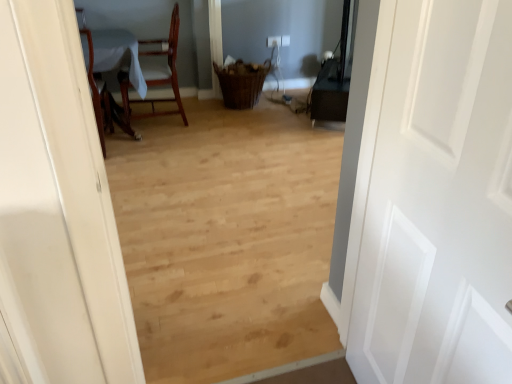
Find the location of `white matte door at right`. white matte door at right is located at coordinates (439, 202).

Identify the location of wooden table at left. The width and height of the screenshot is (512, 384). (103, 94).

The image size is (512, 384). What do you see at coordinates (156, 72) in the screenshot?
I see `mahogany wood chair at upper left` at bounding box center [156, 72].

This screenshot has width=512, height=384. I want to click on white matte door at right, so click(439, 202).

In the image, there is a white matte door at right. Find the location of `table above it (from the image's perspective)`. table above it (from the image's perspective) is located at coordinates (103, 94).

Is white matte door at right thinner than wooden table at left?

Correct, the width of white matte door at right is less than that of wooden table at left.

From the image's perspective, is white matte door at right on wooden table at left?

No, from the image's perspective, white matte door at right is not over wooden table at left.

Are wooden table at left and white matte door at right beside each other?

No.

Is wooden table at left not inside white matte door at right?

Yes, wooden table at left is outside of white matte door at right.

Between wooden table at left and white matte door at right, which one has less height?

Standing shorter between the two is wooden table at left.

Does point (132, 137) come farther from viewer compared to point (395, 297)?

Yes, point (132, 137) is farther from viewer.

Could mahogany wood chair at upper left be considered to be inside wooden table at left?

Definitely not — mahogany wood chair at upper left is not inside wooden table at left.

How many degrees apart are the facing directions of wooden table at left and mahogany wood chair at upper left?

There is a 91.4-degree angle between the facing directions of wooden table at left and mahogany wood chair at upper left.

From the image's perspective, is wooden table at left located above or below mahogany wood chair at upper left?

Clearly, from the image's perspective, wooden table at left is below mahogany wood chair at upper left.

From the image's perspective, does mahogany wood chair at upper left appear higher than wooden table at left?

Indeed, from the image's perspective, mahogany wood chair at upper left is shown above wooden table at left.

From a real-world perspective, is mahogany wood chair at upper left located beneath wooden table at left?

No, from a real-world perspective, mahogany wood chair at upper left is not beneath wooden table at left.

Does point (177, 91) lie behind point (102, 106)?

Yes.

From the image's perspective, would you say mahogany wood chair at upper left is shown under white matte door at right?

No.

From a real-world perspective, is mahogany wood chair at upper left physically below white matte door at right?

Yes, from a real-world perspective, mahogany wood chair at upper left is below white matte door at right.

Considering the positions of objects mahogany wood chair at upper left and white matte door at right in the image provided, who is behind, mahogany wood chair at upper left or white matte door at right?

mahogany wood chair at upper left.

Is mahogany wood chair at upper left placed right next to white matte door at right?

mahogany wood chair at upper left and white matte door at right are not in contact.

Can you confirm if white matte door at right is smaller than mahogany wood chair at upper left?

Yes, white matte door at right is smaller than mahogany wood chair at upper left.

From the picture: Is mahogany wood chair at upper left located within white matte door at right?

No, mahogany wood chair at upper left is located outside of white matte door at right.

Is white matte door at right far from mahogany wood chair at upper left?

Indeed, white matte door at right is not near mahogany wood chair at upper left.

In the scene shown: Which is more to the right, white matte door at right or mahogany wood chair at upper left?

Positioned to the right is white matte door at right.

Where is `table behind the white matte door at right`? This screenshot has height=384, width=512. table behind the white matte door at right is located at coordinates [103, 94].

Locate an element on the screen. The width and height of the screenshot is (512, 384). table that appears on the left of white matte door at right is located at coordinates (103, 94).

Which object lies further to the anchor point wooden table at left, white matte door at right or mahogany wood chair at upper left?

Based on the image, white matte door at right appears to be further to wooden table at left.

Estimate the real-world distances between objects in this image. Which object is further from mahogany wood chair at upper left, white matte door at right or wooden table at left?

The object further to mahogany wood chair at upper left is white matte door at right.

Which object lies further to the anchor point white matte door at right, mahogany wood chair at upper left or wooden table at left?

mahogany wood chair at upper left is further to white matte door at right.

Estimate the real-world distances between objects in this image. Which object is further from mahogany wood chair at upper left, wooden table at left or white matte door at right?

Among the two, white matte door at right is located further to mahogany wood chair at upper left.

In the scene shown: Estimate the real-world distances between objects in this image. Which object is closer to wooden table at left, mahogany wood chair at upper left or white matte door at right?

Based on the image, mahogany wood chair at upper left appears to be nearer to wooden table at left.

Considering their positions, is wooden table at left positioned closer to white matte door at right than mahogany wood chair at upper left?

wooden table at left is closer to white matte door at right.

The height and width of the screenshot is (384, 512). Identify the location of table between white matte door at right and mahogany wood chair at upper left from front to back. (103, 94).